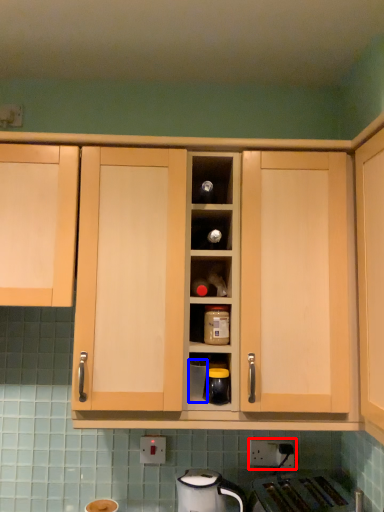
Question: Which of the following is the farthest to the observer, electric outlet (highlighted by a red box) or appliance (highlighted by a blue box)?

Choices:
 (A) electric outlet
 (B) appliance

Answer: (A)